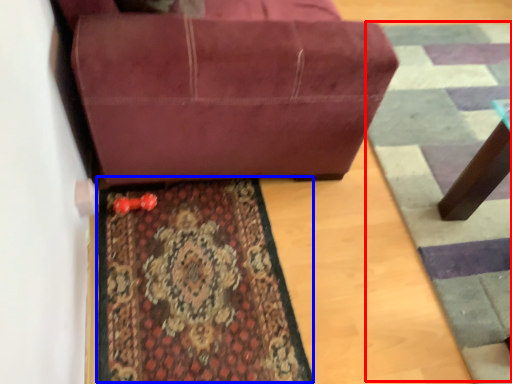
Question: Which point is further to the camera, doormat (highlighted by a red box) or mat (highlighted by a blue box)?

Choices:
 (A) doormat
 (B) mat

Answer: (A)